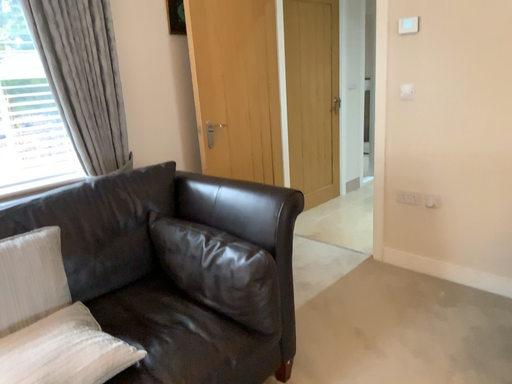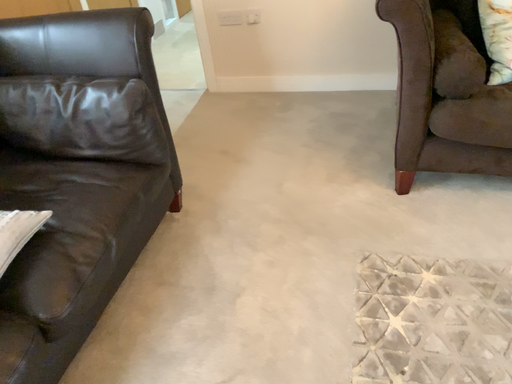
Question: How did the camera likely rotate when shooting the video?

Choices:
 (A) rotated left
 (B) rotated right

Answer: (B)